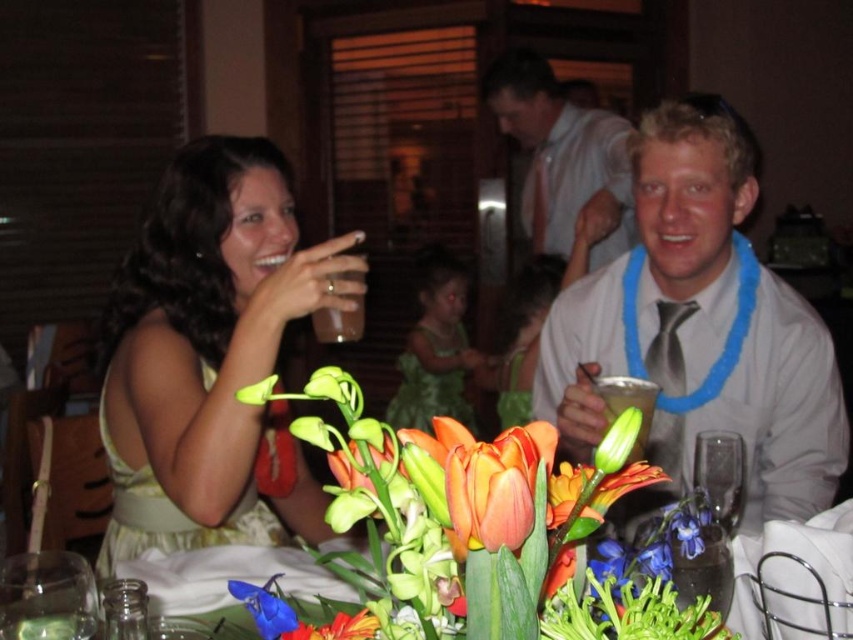
You are at a party and want to place a 10cm tall book on the table. The table has the matte yellow dress at left and the translucent plastic cup at center. Can the book be placed on the table without being hidden by either object?

The matte yellow dress at left is taller than the translucent plastic cup at center. Since the book is 10cm tall, it can be placed on the table as neither object will hide it completely, but ensure it is positioned away from the taller matte yellow dress at left to avoid partial obstruction.

You are taking a photo of the scene and want to focus on both point (105, 412) and point (634, 456). Which point is closer to the camera?

Point (105, 412) is further to the camera than point (634, 456), so the closer point to the camera is point (634, 456).